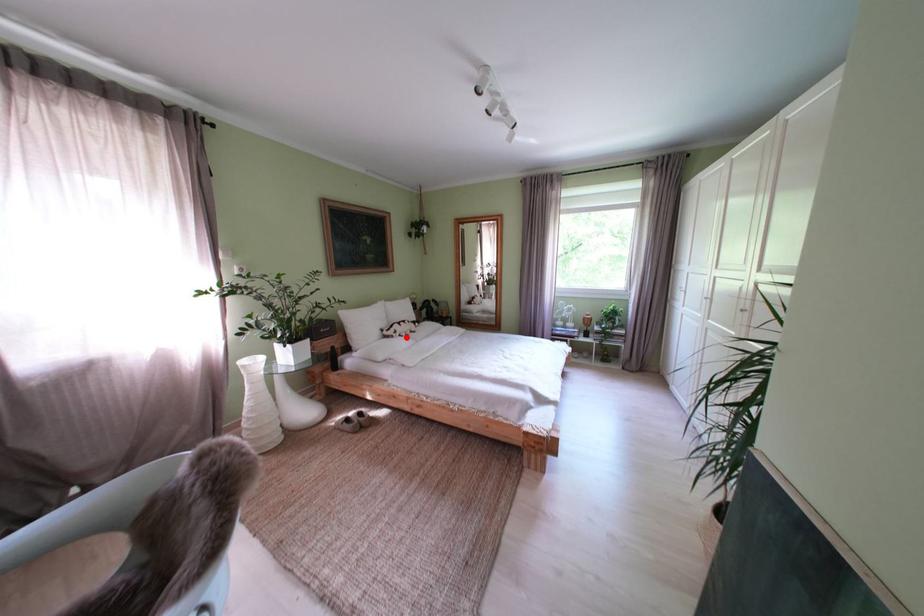
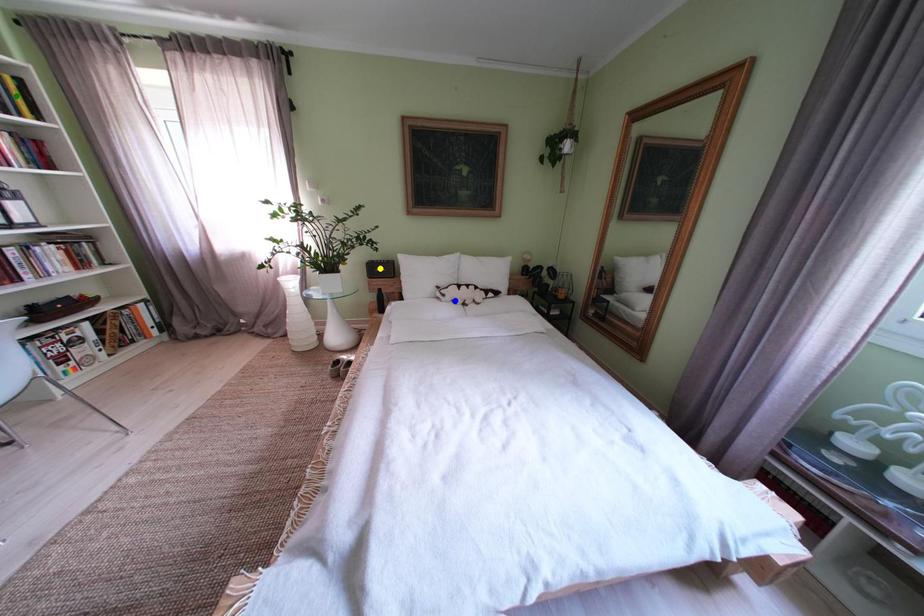
Question: I am providing you with two images of the same scene from different viewpoints. A red point is marked on the first image. You are given multiple points on the second image. Which point in image 2 is actually the same real-world point as the red point in image 1?

Choices:
 (A) yellow point
 (B) green point
 (C) blue point

Answer: (C)